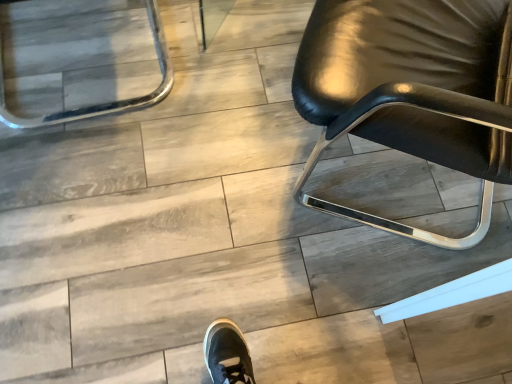
This screenshot has height=384, width=512. I want to click on vacant space in between glossy black chair at right, the 2th chair in the left-to-right sequence, and clear glass tray at upper left, placed as the 2th chair when sorted from right to left, so click(208, 107).